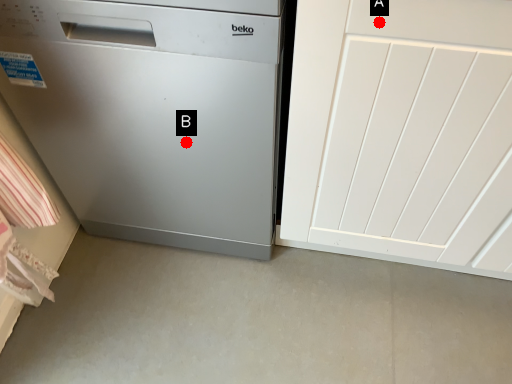
Question: Two points are circled on the image, labeled by A and B beside each circle. Which point is closer to the camera taking this photo?

Choices:
 (A) A is closer
 (B) B is closer

Answer: (A)